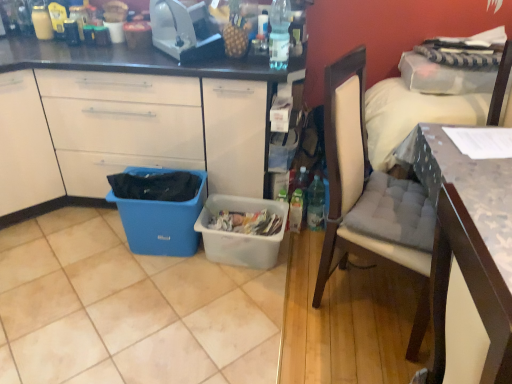
Find the location of a particular element. The image size is (512, 384). free space in front of blue plastic trash can at lower left is located at coordinates (153, 289).